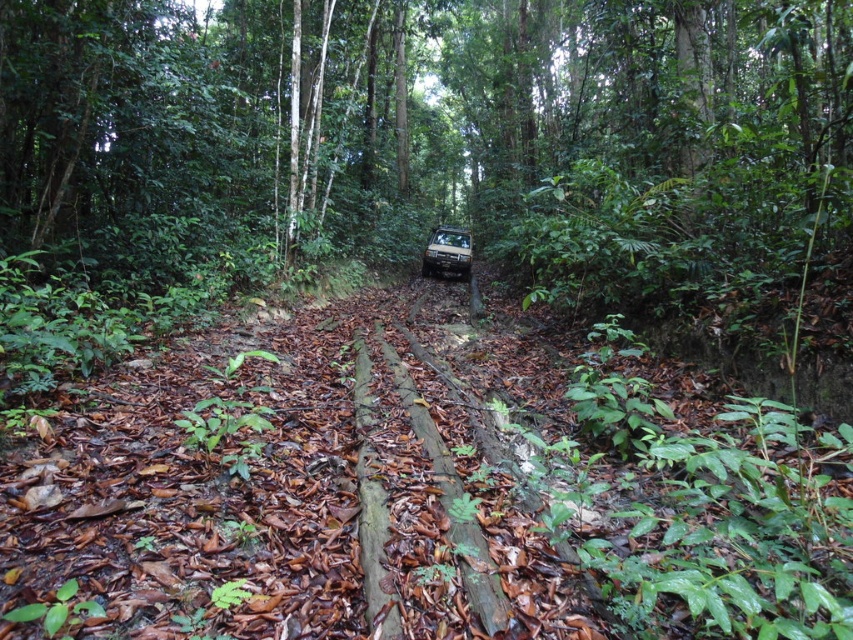
Question: Which is nearer to the brown wood at center?

Choices:
 (A) green leafy tree at center
 (B) metallic silver suv at center

Answer: (B)

Question: Considering the relative positions of green leafy tree at center and brown wood at center in the image provided, where is green leafy tree at center located with respect to brown wood at center?

Choices:
 (A) above
 (B) below

Answer: (A)

Question: Does brown wood at center appear under metallic silver suv at center?

Choices:
 (A) yes
 (B) no

Answer: (A)

Question: Which point is closer to the camera?

Choices:
 (A) metallic silver suv at center
 (B) brown wood at center

Answer: (B)

Question: Is brown wood at center thinner than metallic silver suv at center?

Choices:
 (A) yes
 (B) no

Answer: (B)

Question: Which point is closer to the camera?

Choices:
 (A) brown wood at center
 (B) metallic silver suv at center

Answer: (A)